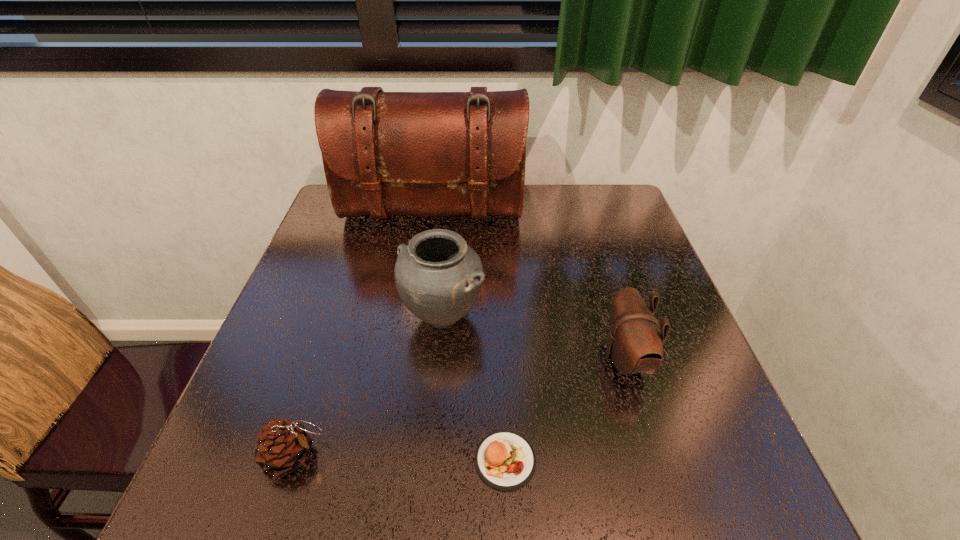
Where is `vacant region between the fourth tallest object and the patty (food)`? Image resolution: width=960 pixels, height=540 pixels. vacant region between the fourth tallest object and the patty (food) is located at coordinates (399, 458).

Locate an element on the screen. free space between the third shortest object and the fourth shortest object is located at coordinates (534, 338).

Image resolution: width=960 pixels, height=540 pixels. What are the coordinates of `blank region between the third shortest object and the pinecone` in the screenshot? It's located at (460, 407).

Where is `empty space between the urn and the third shortest object`? The image size is (960, 540). empty space between the urn and the third shortest object is located at coordinates (534, 338).

Where is `free space between the patty (food) and the rightmost object`? free space between the patty (food) and the rightmost object is located at coordinates (565, 409).

This screenshot has width=960, height=540. I want to click on free space between the pinecone and the rightmost object, so click(460, 407).

The width and height of the screenshot is (960, 540). In order to click on free spot between the patty (food) and the rightmost object in this screenshot , I will do `click(565, 409)`.

I want to click on vacant area that lies between the satchel and the patty (food), so click(x=468, y=336).

The height and width of the screenshot is (540, 960). Find the location of `empty space between the satchel and the second shortest object`. empty space between the satchel and the second shortest object is located at coordinates (364, 334).

Where is `free spot between the urn and the fourth tallest object`? This screenshot has height=540, width=960. free spot between the urn and the fourth tallest object is located at coordinates (369, 386).